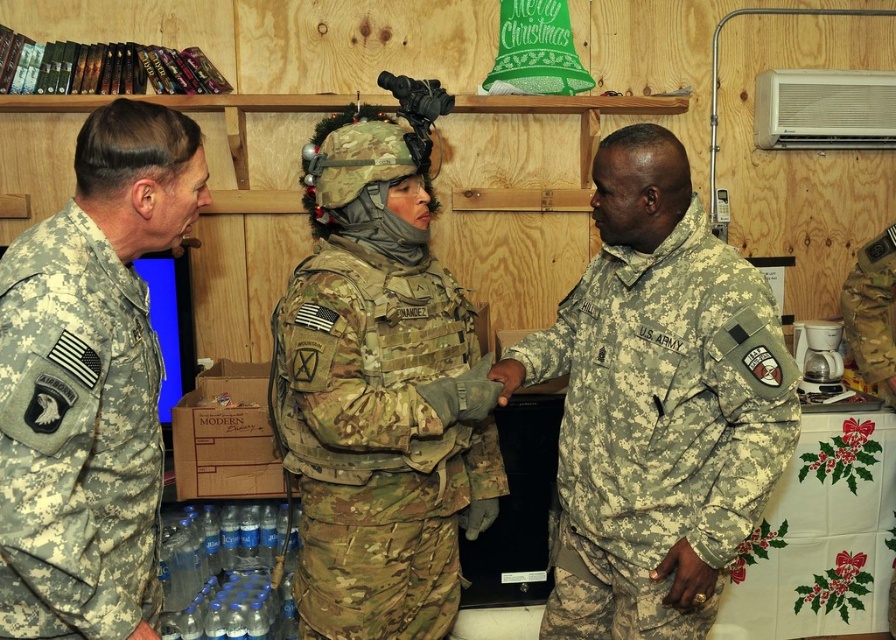
Question: Which point appears farthest from the camera in this image?

Choices:
 (A) (76, 493)
 (B) (635, 486)

Answer: (B)

Question: Considering the real-world distances, which object is farthest from the camouflage fabric us army uniform at center?

Choices:
 (A) camouflage fabric uniform at left
 (B) camouflage fabric uniform at center

Answer: (A)

Question: Can you confirm if camouflage fabric us army uniform at center is positioned to the left of camouflage fabric uniform at center?

Choices:
 (A) yes
 (B) no

Answer: (B)

Question: Based on their relative distances, which object is farther from the camouflage fabric uniform at left?

Choices:
 (A) camouflage fabric us army uniform at center
 (B) camouflage fabric uniform at center

Answer: (A)

Question: Can you confirm if camouflage fabric uniform at center is smaller than camouflage fabric uniform at left?

Choices:
 (A) yes
 (B) no

Answer: (B)

Question: Does camouflage fabric us army uniform at center have a smaller size compared to camouflage fabric uniform at left?

Choices:
 (A) no
 (B) yes

Answer: (A)